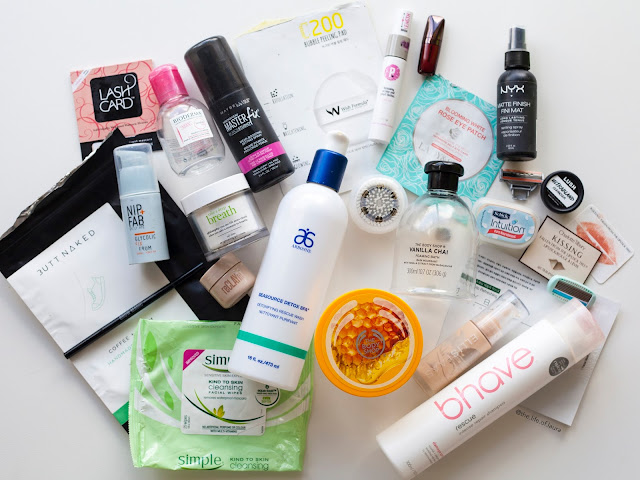
This screenshot has height=480, width=640. In order to click on wipes in this screenshot , I will do `click(230, 424)`.